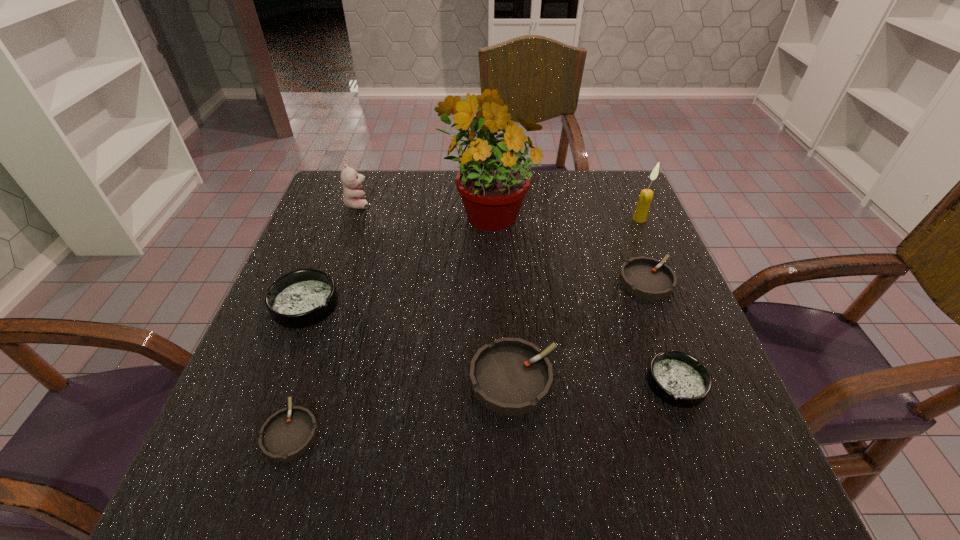
Locate an element on the screen. vacant area situated on the right of the bigger dark ashtray is located at coordinates (506, 304).

This screenshot has width=960, height=540. I want to click on vacant region located on the back of the rightmost gray ashtray, so click(x=617, y=205).

Identify the location of free space located 0.320m on the back of the right dark ashtray. The width and height of the screenshot is (960, 540). (628, 252).

Image resolution: width=960 pixels, height=540 pixels. Identify the location of vacant space located 0.400m on the right of the shortest object. coord(551,431).

Locate an element on the screen. The image size is (960, 540). flowerpot located in the far edge section of the desktop is located at coordinates (492, 183).

The height and width of the screenshot is (540, 960). I want to click on candle at the far edge, so pyautogui.click(x=646, y=195).

The width and height of the screenshot is (960, 540). In order to click on teddy bear positioned at the far edge in this screenshot , I will do `click(353, 197)`.

This screenshot has height=540, width=960. What are the coordinates of `object that is at the near edge` in the screenshot? It's located at (287, 434).

This screenshot has height=540, width=960. I want to click on teddy bear located in the left edge section of the desktop, so click(353, 197).

This screenshot has width=960, height=540. Identify the location of candle located at the right edge. (646, 195).